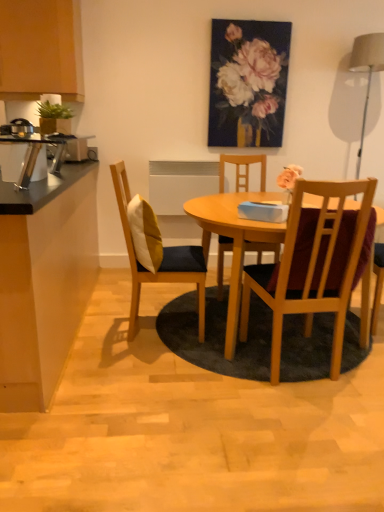
Question: Is wooden chair with cushion at center, the 3th chair from the right, positioned beyond the bounds of brushed metal toaster at left, the 1th appliance positioned from the left?

Choices:
 (A) yes
 (B) no

Answer: (A)

Question: Considering the relative sizes of wooden chair with cushion at center, the 3th chair from the right, and brushed metal toaster at left, the 2th appliance from the bottom, in the image provided, is wooden chair with cushion at center, the 3th chair from the right, shorter than brushed metal toaster at left, the 2th appliance from the bottom,?

Choices:
 (A) yes
 (B) no

Answer: (B)

Question: Is wooden chair with cushion at center, the 3th chair from the right, smaller than brushed metal toaster at left, marked as the second appliance in a front-to-back arrangement?

Choices:
 (A) no
 (B) yes

Answer: (A)

Question: From a real-world perspective, is wooden chair with cushion at center, the 3th chair from the right, physically above brushed metal toaster at left, the 1th appliance positioned from the left?

Choices:
 (A) yes
 (B) no

Answer: (B)

Question: Is wooden chair with cushion at center, which is counted as the first chair, starting from the left, in contact with brushed metal toaster at left, the first appliance positioned from the back?

Choices:
 (A) no
 (B) yes

Answer: (A)

Question: From a real-world perspective, relative to matte wood cabinet at upper left, is wooden chair with cushion at center, which is counted as the first chair, starting from the left, vertically above or below?

Choices:
 (A) below
 (B) above

Answer: (A)

Question: Is wooden chair with cushion at center, the 3th chair from the right, situated inside matte wood cabinet at upper left or outside?

Choices:
 (A) outside
 (B) inside

Answer: (A)

Question: In the image, is wooden chair with cushion at center, which is counted as the first chair, starting from the left, positioned in front of or behind matte wood cabinet at upper left?

Choices:
 (A) front
 (B) behind

Answer: (A)

Question: Considering the relative positions of wooden chair with cushion at center, the 3th chair from the right, and matte wood cabinet at upper left in the image provided, is wooden chair with cushion at center, the 3th chair from the right, to the left or to the right of matte wood cabinet at upper left?

Choices:
 (A) left
 (B) right

Answer: (B)

Question: Is wooden chair at center, the 2th chair when ordered from left to right, inside the boundaries of metallic silver toaster at left, positioned as the first appliance in bottom-to-top order, or outside?

Choices:
 (A) outside
 (B) inside

Answer: (A)

Question: Is wooden chair at center, the 2th chair when ordered from left to right, wider or thinner than metallic silver toaster at left, which is the 1th appliance in right-to-left order?

Choices:
 (A) wide
 (B) thin

Answer: (A)

Question: From their relative heights in the image, would you say wooden chair at center, which is counted as the second chair, starting from the right, is taller or shorter than metallic silver toaster at left, positioned as the first appliance in bottom-to-top order?

Choices:
 (A) tall
 (B) short

Answer: (A)

Question: Visually, is wooden chair at center, which is counted as the second chair, starting from the right, positioned to the left or to the right of metallic silver toaster at left, positioned as the first appliance in bottom-to-top order?

Choices:
 (A) right
 (B) left

Answer: (A)

Question: From a real-world perspective, is wooden chair at center, which is the 1th chair in right-to-left order, physically located above or below matte gray lampshade at upper right?

Choices:
 (A) above
 (B) below

Answer: (B)

Question: Considering the positions of point (297, 267) and point (365, 108), is point (297, 267) closer or farther from the camera than point (365, 108)?

Choices:
 (A) closer
 (B) farther

Answer: (A)